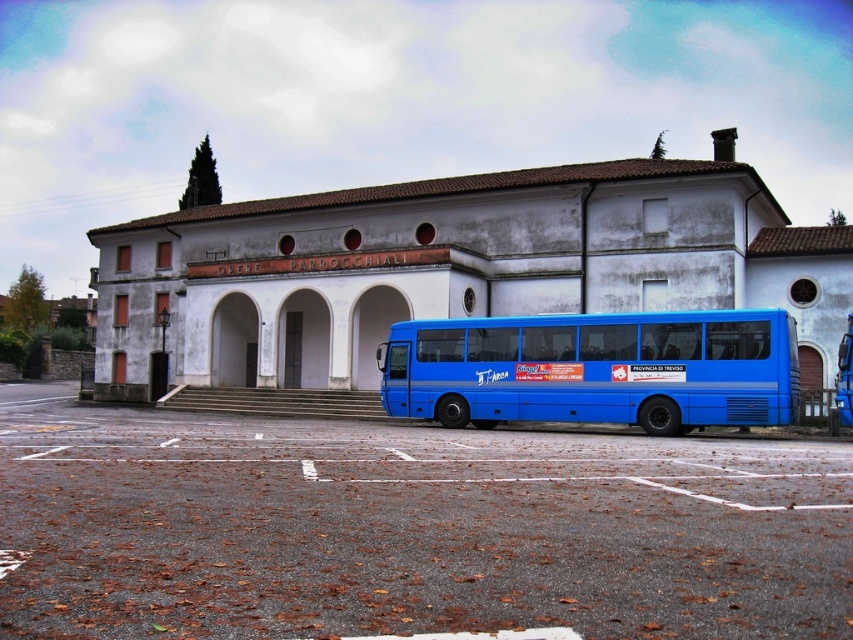
You are a delivery person trying to park your van in the smooth asphalt parking lot at center. The blue metallic bus at center is blocking the entrance. Can you drive around the bus to access the parking lot?

The smooth asphalt parking lot at center is below the blue metallic bus at center, meaning the bus is positioned over the parking lot. Since the bus is blocking the entrance, you cannot drive around it to access the parking lot.

You are a delivery person trying to park your vehicle in the area in front of the Operae Parrocchiali building. You see the blue metallic bus at center and the white smooth archway at center. According to the faint white markings on the paved area, which vehicle should you avoid blocking when parking?

The blue metallic bus at center is positioned under the white smooth archway at center, so you should avoid blocking the blue metallic bus at center since it is currently parked under the archway and might be occupying a designated parking space marked by the white markings.

You are a delivery driver who needs to park your truck in the smooth asphalt parking lot at center. The truck is 2.5 meters wide. The white smooth archway at center is part of the building entrance. Can your truck fit through the archway while entering the parking lot?

The smooth asphalt parking lot at center might be wider than the white smooth archway at center, but since the archway width is not specified, it is uncertain if the 2.5 meter wide truck can pass through. Check the archway width before proceeding.